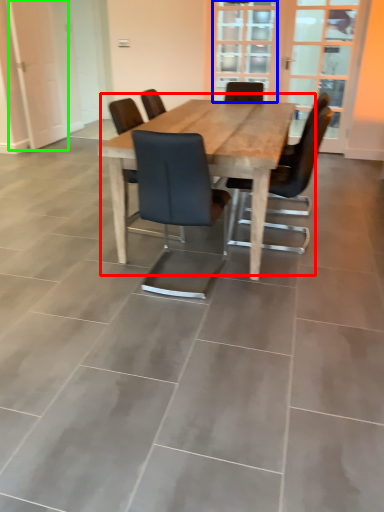
Question: Which object is positioned farthest from kitchen & dining room table (highlighted by a red box)? Select from glass door (highlighted by a blue box) and screen door (highlighted by a green box).

Choices:
 (A) glass door
 (B) screen door

Answer: (A)